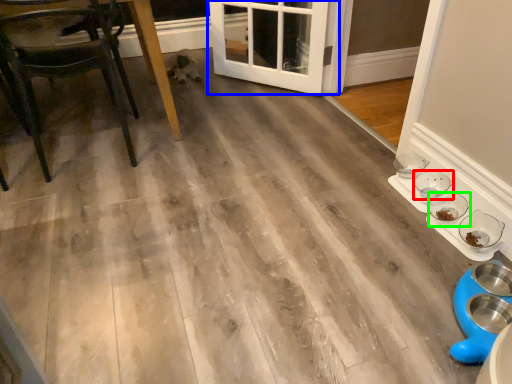
Question: Estimate the real-world distances between objects in this image. Which object is farther from bowl (highlighted by a red box), door (highlighted by a blue box) or bowl (highlighted by a green box)?

Choices:
 (A) door
 (B) bowl

Answer: (A)